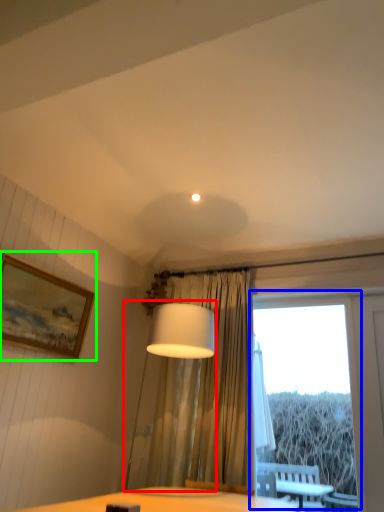
Question: Based on their relative distances, which object is nearer to table lamp (highlighted by a red box)? Choose from window (highlighted by a blue box) and picture frame (highlighted by a green box).

Choices:
 (A) window
 (B) picture frame

Answer: (B)